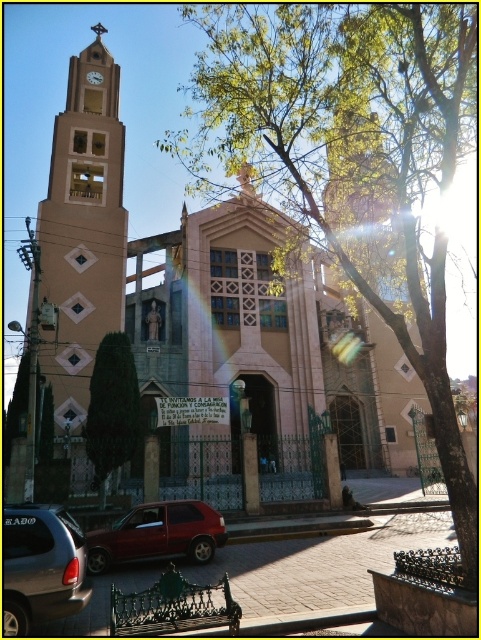
You are standing in front of the church and notice the green leafy tree at upper center and the light beige stone bell tower at left. Which object is closer to you from your current viewpoint?

The green leafy tree at upper center is closer to you because it is in front of the light beige stone bell tower at left.

You are standing in front of the church and notice the green leafy tree at upper center and the light beige stone bell tower at left. Which object is positioned to the right of the other?

The green leafy tree at upper center is positioned to the right of the light beige stone bell tower at left.